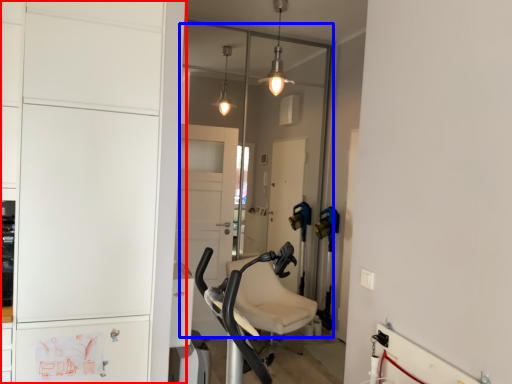
Question: Which object appears farthest to the camera in this image, cabinetry (highlighted by a red box) or glass door (highlighted by a blue box)?

Choices:
 (A) cabinetry
 (B) glass door

Answer: (B)